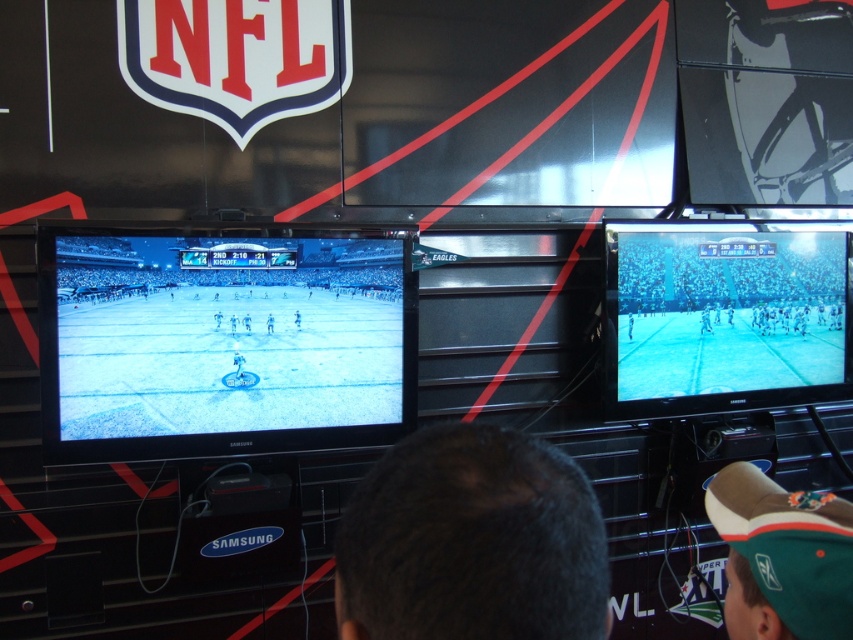
You are a photographer standing in front of the two Samsung televisions. You notice the dark hair at center and the white glossy figure at center in the scene. Which object is taller?

The dark hair at center is much taller than the white glossy figure at center.

You are standing in front of the two Samsung televisions and want to place a small decorative item on the point closer to you. Which point should you choose between point (x=730, y=545) and point (x=230, y=324)?

You should choose point (x=730, y=545) because it is closer to the viewer compared to point (x=230, y=324).

Based on the coordinates provided, which object corresponds to the point at (782, 556)?

The point at (782, 556) corresponds to the green fabric cap at lower right.